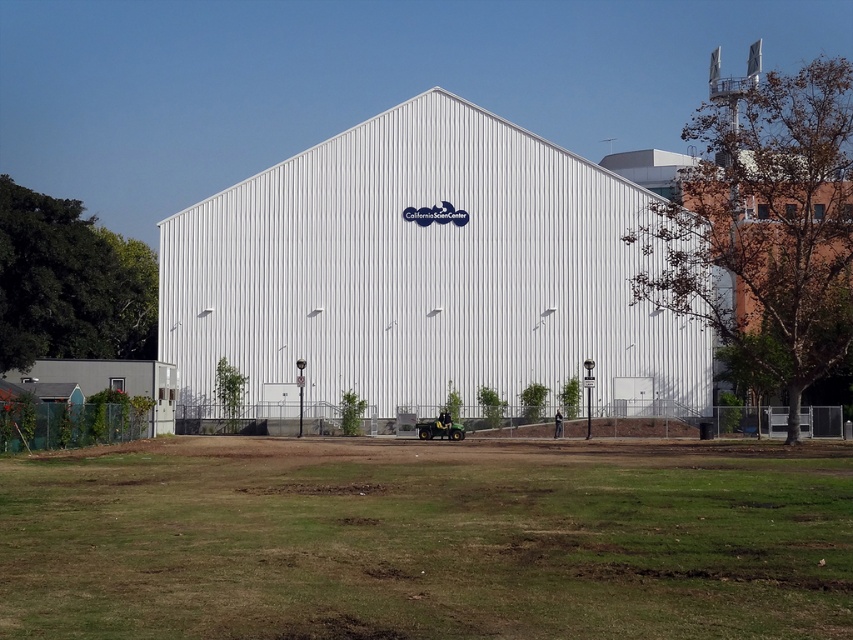
Question: Can you confirm if green grass at lower center is thinner than white corrugated metal building at center?

Choices:
 (A) no
 (B) yes

Answer: (B)

Question: Which point is closer to the camera?

Choices:
 (A) green grass at lower center
 (B) white corrugated metal building at center

Answer: (A)

Question: From the image, what is the correct spatial relationship of green grass at lower center in relation to white corrugated metal building at center?

Choices:
 (A) right
 (B) left

Answer: (A)

Question: Can you confirm if green grass at lower center is positioned below white corrugated metal building at center?

Choices:
 (A) no
 (B) yes

Answer: (B)

Question: Which point appears closest to the camera in this image?

Choices:
 (A) (56, 611)
 (B) (424, 321)

Answer: (A)